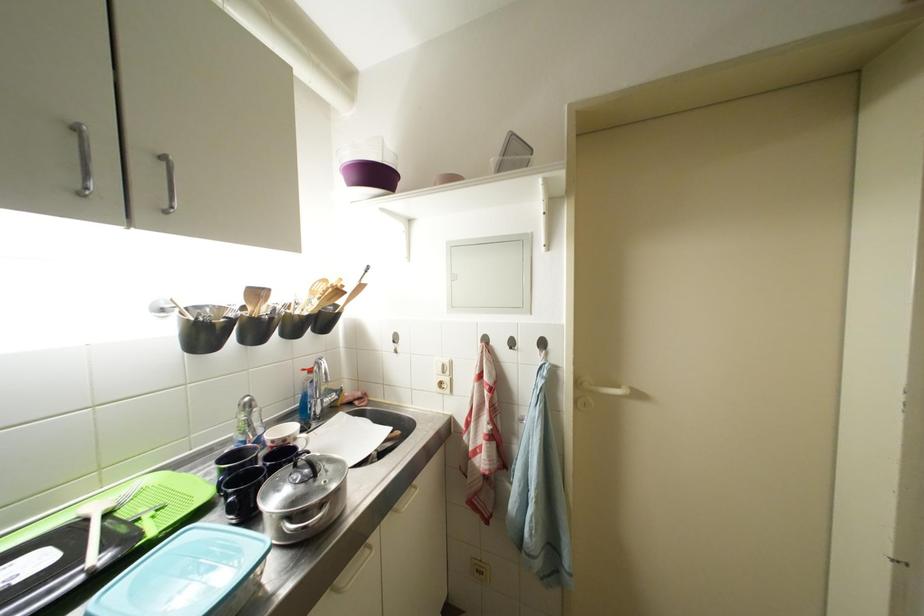
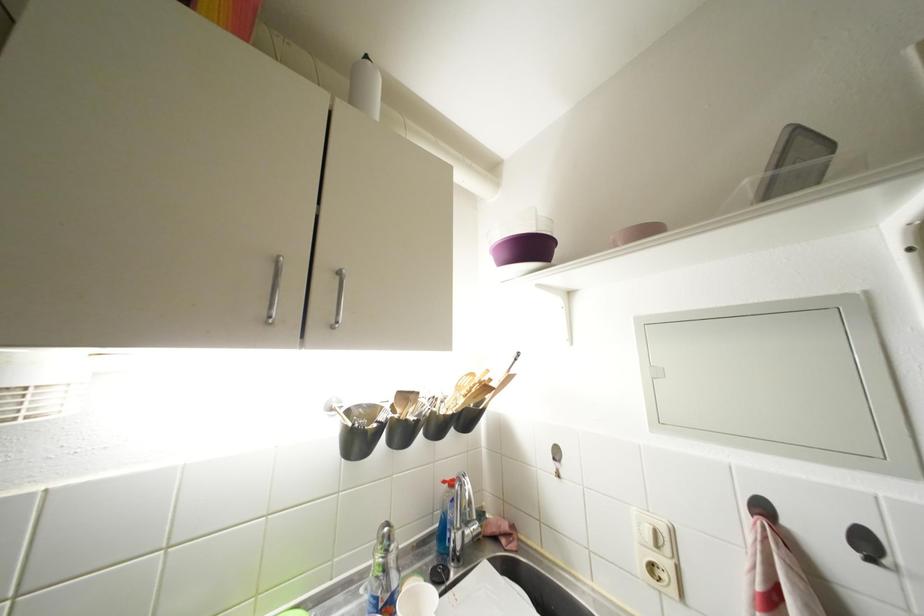
Locate, in the second image, the point that corresponds to [317,375] in the first image.

(457, 488)